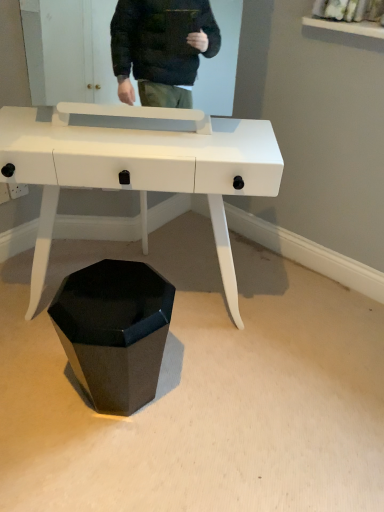
Question: From a real-world perspective, is white glossy desk at center positioned under glossy black hexagonal at lower center based on gravity?

Choices:
 (A) yes
 (B) no

Answer: (B)

Question: Does white glossy desk at center have a larger size compared to glossy black hexagonal at lower center?

Choices:
 (A) yes
 (B) no

Answer: (A)

Question: Is white glossy desk at center oriented towards glossy black hexagonal at lower center?

Choices:
 (A) yes
 (B) no

Answer: (A)

Question: Can you confirm if white glossy desk at center is smaller than glossy black hexagonal at lower center?

Choices:
 (A) no
 (B) yes

Answer: (A)

Question: Is white glossy desk at center to the right of glossy black hexagonal at lower center from the viewer's perspective?

Choices:
 (A) no
 (B) yes

Answer: (B)

Question: From the image's perspective, is white glossy desk at center located above glossy black hexagonal at lower center?

Choices:
 (A) yes
 (B) no

Answer: (A)

Question: Could you tell me if glossy black hexagonal at lower center is turned towards white glossy desk at center?

Choices:
 (A) no
 (B) yes

Answer: (B)

Question: Considering the relative sizes of glossy black hexagonal at lower center and white glossy desk at center in the image provided, is glossy black hexagonal at lower center smaller than white glossy desk at center?

Choices:
 (A) yes
 (B) no

Answer: (A)

Question: Is glossy black hexagonal at lower center surrounding white glossy desk at center?

Choices:
 (A) yes
 (B) no

Answer: (B)

Question: Is glossy black hexagonal at lower center oriented away from white glossy desk at center?

Choices:
 (A) yes
 (B) no

Answer: (B)

Question: Considering the relative sizes of glossy black hexagonal at lower center and white glossy desk at center in the image provided, is glossy black hexagonal at lower center thinner than white glossy desk at center?

Choices:
 (A) no
 (B) yes

Answer: (B)

Question: Is the position of glossy black hexagonal at lower center less distant than that of white glossy desk at center?

Choices:
 (A) no
 (B) yes

Answer: (A)

Question: Is glossy black hexagonal at lower center inside the boundaries of white glossy desk at center, or outside?

Choices:
 (A) outside
 (B) inside

Answer: (A)